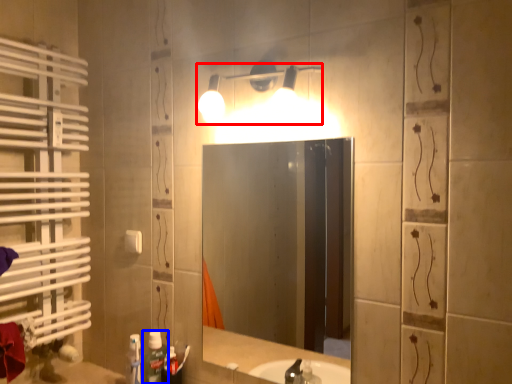
Question: Which point is further to the camera, light fixture (highlighted by a red box) or bottle (highlighted by a blue box)?

Choices:
 (A) light fixture
 (B) bottle

Answer: (B)